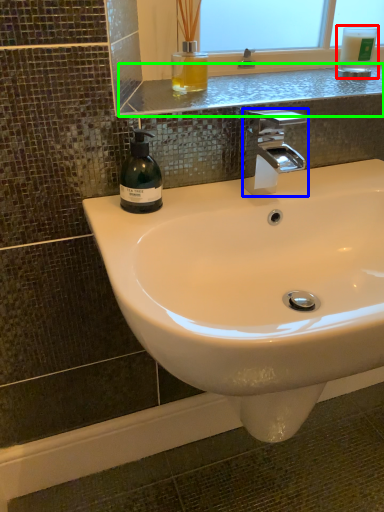
Question: Which object is positioned farthest from mouthwash (highlighted by a red box)? Select from tap (highlighted by a blue box) and window sill (highlighted by a green box).

Choices:
 (A) tap
 (B) window sill

Answer: (A)